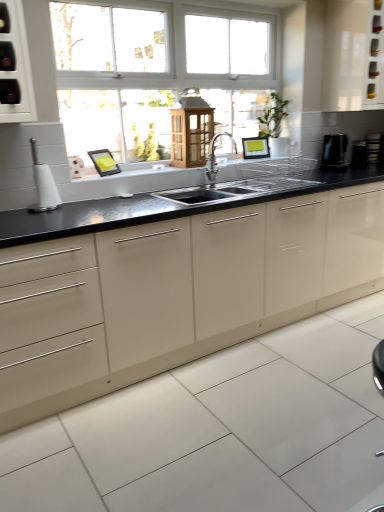
Question: Does black glossy kettle at right, which is counted as the third appliance, starting from the back, have a greater width compared to black plastic toaster at right, the 4th appliance in the front-to-back sequence?

Choices:
 (A) no
 (B) yes

Answer: (B)

Question: Does black glossy kettle at right, which is counted as the third appliance, starting from the back, turn towards black plastic toaster at right, the 4th appliance in the front-to-back sequence?

Choices:
 (A) no
 (B) yes

Answer: (A)

Question: From a real-world perspective, is black glossy kettle at right, the second appliance when ordered from front to back, physically above black plastic toaster at right, arranged as the fourth appliance when viewed from the left?

Choices:
 (A) no
 (B) yes

Answer: (B)

Question: Can you confirm if black glossy kettle at right, the second appliance when ordered from front to back, is positioned to the left of black plastic toaster at right, which is the 1th appliance in back-to-front order?

Choices:
 (A) yes
 (B) no

Answer: (A)

Question: Is the position of black glossy kettle at right, which is counted as the third appliance, starting from the back, less distant than that of black plastic toaster at right, which is the 1th appliance in back-to-front order?

Choices:
 (A) no
 (B) yes

Answer: (B)

Question: Can you confirm if black glossy kettle at right, the second appliance when ordered from front to back, is shorter than black plastic toaster at right, the 4th appliance in the front-to-back sequence?

Choices:
 (A) yes
 (B) no

Answer: (B)

Question: Can you confirm if black granite countertop at center is bigger than black plastic toaster at right, the 2th appliance in the back-to-front sequence?

Choices:
 (A) yes
 (B) no

Answer: (A)

Question: Is black granite countertop at center at the right side of black plastic toaster at right, the third appliance when ordered from left to right?

Choices:
 (A) yes
 (B) no

Answer: (B)

Question: Is black granite countertop at center in contact with black plastic toaster at right, which is the 3th appliance in front-to-back order?

Choices:
 (A) yes
 (B) no

Answer: (B)

Question: Is black granite countertop at center positioned far away from black plastic toaster at right, which appears as the 2th appliance when viewed from the right?

Choices:
 (A) no
 (B) yes

Answer: (B)

Question: Does black granite countertop at center lie behind black plastic toaster at right, the 2th appliance in the back-to-front sequence?

Choices:
 (A) yes
 (B) no

Answer: (B)

Question: Is black granite countertop at center looking in the opposite direction of black plastic toaster at right, the 2th appliance in the back-to-front sequence?

Choices:
 (A) no
 (B) yes

Answer: (A)

Question: Does black granite countertop at center have a greater height compared to wooden lantern at center, the 2th cabinetry when ordered from top to bottom?

Choices:
 (A) no
 (B) yes

Answer: (B)